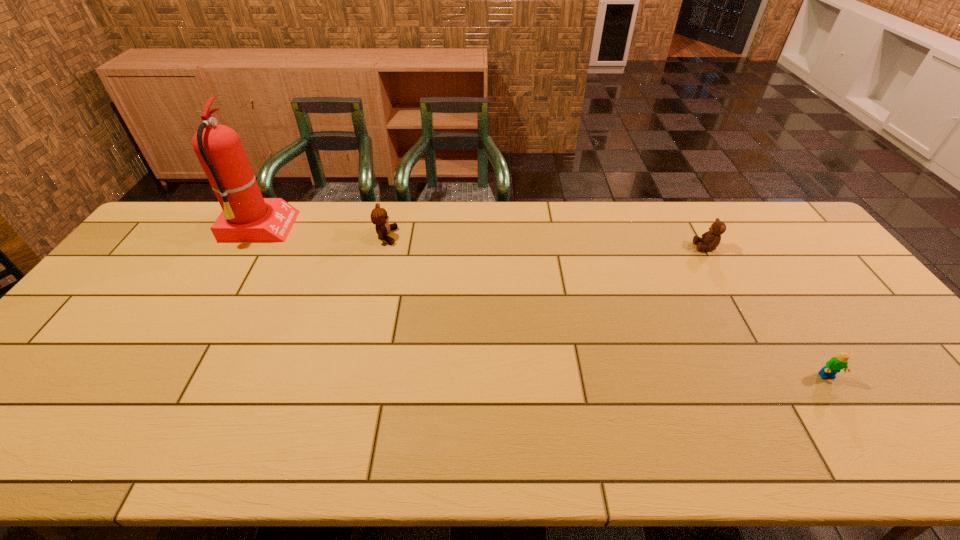
I want to click on vacant area situated 0.050m on the face of the third object from left to right, so click(x=679, y=247).

At what (x,y) coordinates should I click in order to perform the action: click on vacant space situated 0.350m on the face of the third object from left to right. Please return your answer as a coordinate pair (x, y). The width and height of the screenshot is (960, 540). Looking at the image, I should click on (585, 247).

Find the location of a particular element. This screenshot has height=540, width=960. vacant space located on the face of the nearest object is located at coordinates (861, 429).

Image resolution: width=960 pixels, height=540 pixels. In order to click on fire extinguisher that is at the far edge in this screenshot , I will do `click(246, 217)`.

The image size is (960, 540). I want to click on free spot at the far edge of the desktop, so click(369, 204).

Image resolution: width=960 pixels, height=540 pixels. What are the coordinates of `free space at the near edge of the desktop` in the screenshot? It's located at (129, 446).

This screenshot has height=540, width=960. In the image, there is a desktop. What are the coordinates of `free space at the left edge` in the screenshot? It's located at (134, 282).

Image resolution: width=960 pixels, height=540 pixels. I want to click on vacant region at the right edge, so click(x=871, y=378).

You are a GUI agent. You are given a task and a screenshot of the screen. Output one action in this format:
    pyautogui.click(x=<x>, y=<y>)
    Task: Click on the free space at the far right corner
    
    Given the screenshot: What is the action you would take?
    pyautogui.click(x=778, y=220)

Where is `free space between the leftmost object and the Lego`? This screenshot has width=960, height=540. free space between the leftmost object and the Lego is located at coordinates (543, 302).